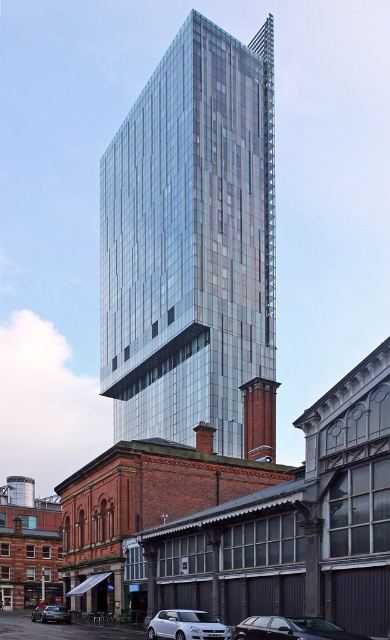
Question: Does glassy metallic skyscraper at center appear over matte black car at lower left?

Choices:
 (A) yes
 (B) no

Answer: (A)

Question: Is white matte suv at lower center to the right of matte black car at lower left from the viewer's perspective?

Choices:
 (A) no
 (B) yes

Answer: (B)

Question: Can you confirm if glassy metallic skyscraper at center is positioned above matte black car at lower left?

Choices:
 (A) no
 (B) yes

Answer: (B)

Question: Which of these objects is positioned farthest from the metallic silver car at lower center?

Choices:
 (A) matte black car at lower left
 (B) glassy metallic skyscraper at center
 (C) white matte suv at lower center

Answer: (B)

Question: Among these objects, which one is nearest to the camera?

Choices:
 (A) white matte suv at lower center
 (B) glassy metallic skyscraper at center

Answer: (A)

Question: Which point appears closest to the camera in this image?

Choices:
 (A) (42, 620)
 (B) (265, 97)

Answer: (A)